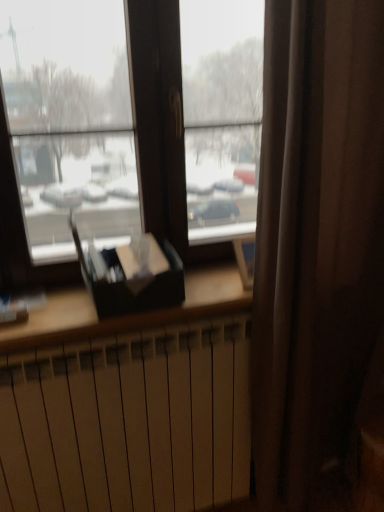
Find the location of a particular element. The image size is (384, 512). white matte radiator at lower center is located at coordinates (128, 422).

The image size is (384, 512). What do you see at coordinates (128, 422) in the screenshot?
I see `white matte radiator at lower center` at bounding box center [128, 422].

Locate an element on the screen. The width and height of the screenshot is (384, 512). matte black book at center is located at coordinates (131, 275).

Describe the element at coordinates (131, 275) in the screenshot. This screenshot has height=512, width=384. I see `matte black book at center` at that location.

What is the approximate width of matte black book at center?

The width of matte black book at center is 16.81 inches.

Locate an element on the screen. Image resolution: width=384 pixels, height=512 pixels. white matte radiator at lower center is located at coordinates (128, 422).

Considering the positions of objects matte black book at center and white matte radiator at lower center in the image provided, who is more to the right, matte black book at center or white matte radiator at lower center?

white matte radiator at lower center is more to the right.

Relative to white matte radiator at lower center, is matte black book at center in front or behind?

Clearly, matte black book at center is behind white matte radiator at lower center.

Is point (103, 271) positioned behind point (211, 362)?

That is False.

From the image's perspective, is matte black book at center located above or below white matte radiator at lower center?

matte black book at center is above white matte radiator at lower center.

From a real-world perspective, between matte black book at center and white matte radiator at lower center, who is vertically lower?

From a 3D spatial view, white matte radiator at lower center is below.

Consider the image. Which of these two, matte black book at center or white matte radiator at lower center, is thinner?

white matte radiator at lower center is thinner.

From the picture: Who is shorter, matte black book at center or white matte radiator at lower center?

matte black book at center.

In the scene shown: Which of these two, matte black book at center or white matte radiator at lower center, is smaller?

Smaller between the two is matte black book at center.

Is matte black book at center spatially inside white matte radiator at lower center, or outside of it?

matte black book at center lies outside white matte radiator at lower center.

Would you say matte black book at center is a long distance from white matte radiator at lower center?

That's not correct — matte black book at center is a little close to white matte radiator at lower center.

Is matte black book at center positioned with its back to white matte radiator at lower center?

No, white matte radiator at lower center is not at the back of matte black book at center.

Can you tell me how much matte black book at center and white matte radiator at lower center differ in facing direction?

There is a 2.61-degree angle between the facing directions of matte black book at center and white matte radiator at lower center.

This screenshot has width=384, height=512. I want to click on paperback book above the white matte radiator at lower center (from a real-world perspective), so click(x=131, y=275).

Is white matte radiator at lower center to the left or to the right of matte black book at center in the image?

white matte radiator at lower center is to the right of matte black book at center.

Which object is further away from the camera, white matte radiator at lower center or matte black book at center?

matte black book at center is behind.

Which is less distant, (7, 507) or (161, 275)?

Point (7, 507) is farther from the camera than point (161, 275).

From the image's perspective, would you say white matte radiator at lower center is positioned over matte black book at center?

Incorrect, from the image's perspective, white matte radiator at lower center is lower than matte black book at center.

From a real-world perspective, who is located higher, white matte radiator at lower center or matte black book at center?

matte black book at center is physically above.

Which object is wider, white matte radiator at lower center or matte black book at center?

matte black book at center.

From the picture: Does white matte radiator at lower center have a lesser height compared to matte black book at center?

Incorrect, the height of white matte radiator at lower center does not fall short of that of matte black book at center.

Does white matte radiator at lower center have a larger size compared to matte black book at center?

Correct, white matte radiator at lower center is larger in size than matte black book at center.

Is white matte radiator at lower center located outside matte black book at center?

Indeed, white matte radiator at lower center is completely outside matte black book at center.

Is white matte radiator at lower center placed right next to matte black book at center?

No, white matte radiator at lower center is not making contact with matte black book at center.

Is white matte radiator at lower center oriented away from matte black book at center?

That's not correct — white matte radiator at lower center is not looking away from matte black book at center.

Can you tell me how much white matte radiator at lower center and matte black book at center differ in facing direction?

They differ by 2.61 degrees in their facing directions.

Image resolution: width=384 pixels, height=512 pixels. What are the coordinates of `paperback book that is above the white matte radiator at lower center (from the image's perspective)` in the screenshot? It's located at (131, 275).

The image size is (384, 512). Find the location of `radiator in front of the matte black book at center`. radiator in front of the matte black book at center is located at coordinates (128, 422).

This screenshot has height=512, width=384. What are the coordinates of `paperback book on the left side of white matte radiator at lower center` in the screenshot? It's located at (131, 275).